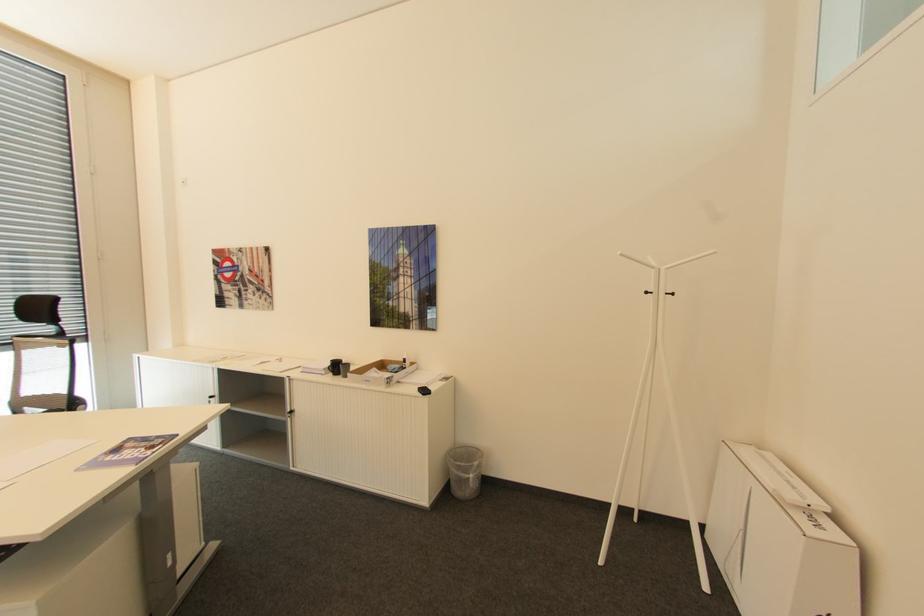
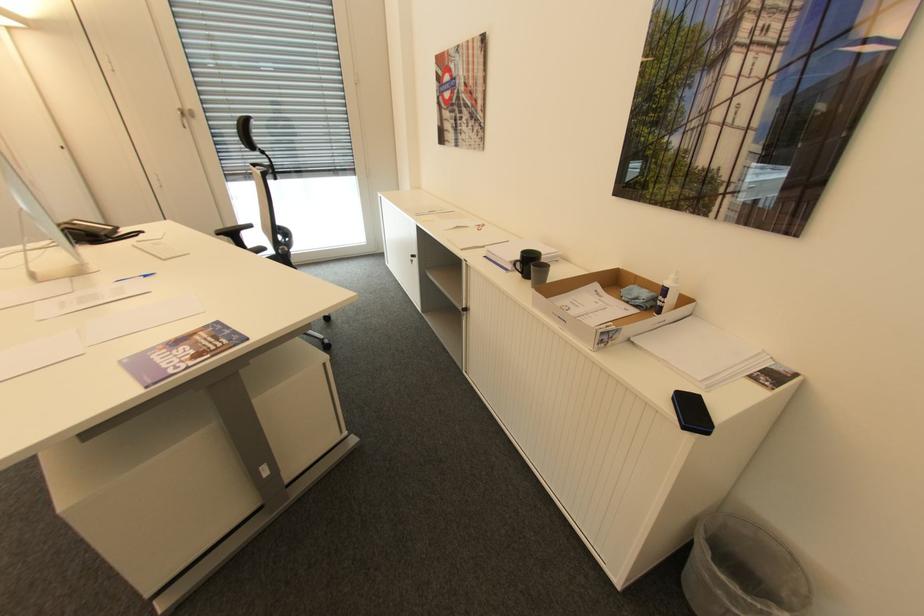
Find the pixel in the second image that matches (329,369) in the first image.

(516, 262)